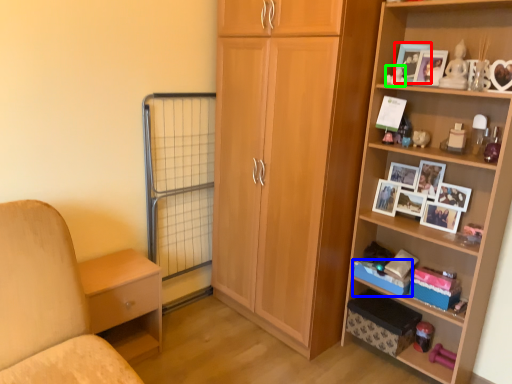
Question: Which object is the closest to the picture frame (highlighted by a red box)? Choose among these: storage box (highlighted by a blue box) or toy (highlighted by a green box).

Choices:
 (A) storage box
 (B) toy

Answer: (B)